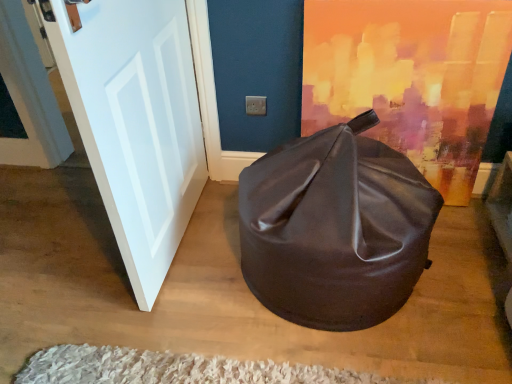
At what (x,y) coordinates should I click in order to perform the action: click on vacant area that is situated to the right of shiny brown bean bag at center. Please return your answer as a coordinate pair (x, y). This screenshot has width=512, height=384. Looking at the image, I should click on (464, 274).